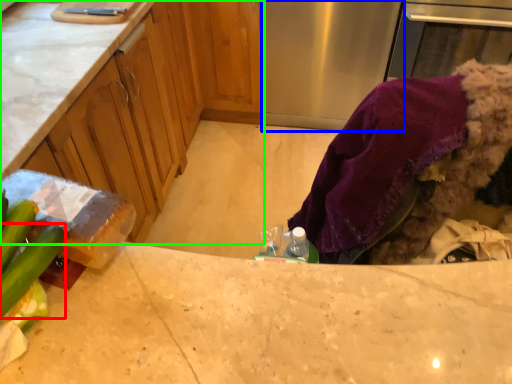
Question: Which is nearer to the cucumber (highlighted by a red box)? appliance (highlighted by a blue box) or cabinetry (highlighted by a green box).

Choices:
 (A) appliance
 (B) cabinetry

Answer: (B)